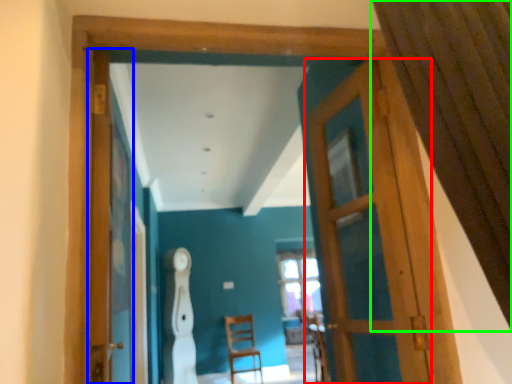
Question: Which object is the closest to the door (highlighted by a red box)? Choose among these: screen door (highlighted by a blue box) or curtain (highlighted by a green box).

Choices:
 (A) screen door
 (B) curtain

Answer: (B)